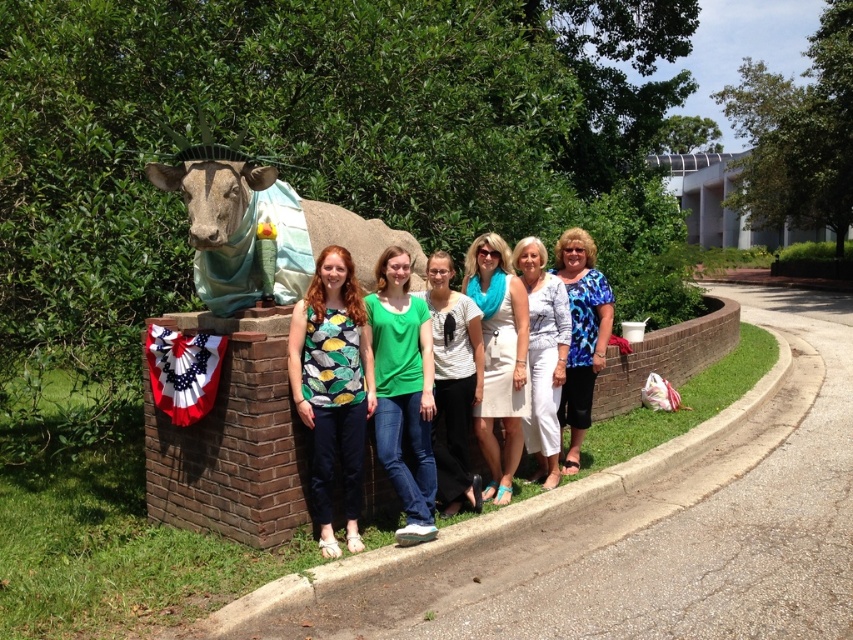
Based on the photo, you are a photographer who wants to ensure all subjects are in focus. You notice the green cotton shirt at center and the blue printed blouse at center. Which one is closer to you, requiring you to adjust your focus accordingly?

The green cotton shirt at center is closer to the viewer than the blue printed blouse at center, so you should focus on the green cotton shirt at center first to ensure clarity.

You are a photographer trying to adjust the focus on your camera. You notice two white items at the center of the image. Which one is closer to the camera lens? The white fabric skirt at center or the white textured blouse at center?

The white fabric skirt at center is located above the white textured blouse at center, so the skirt is closer to the camera lens.